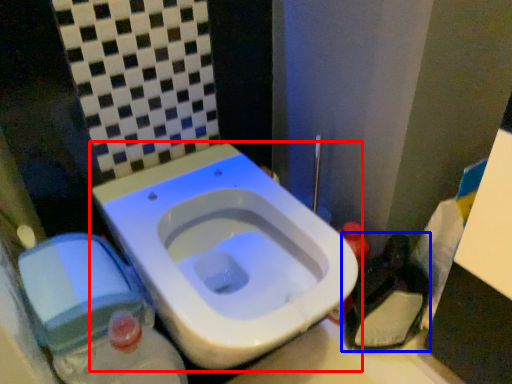
Question: Among these objects, which one is farthest to the camera, toilet (highlighted by a red box) or garbage (highlighted by a blue box)?

Choices:
 (A) toilet
 (B) garbage

Answer: (B)